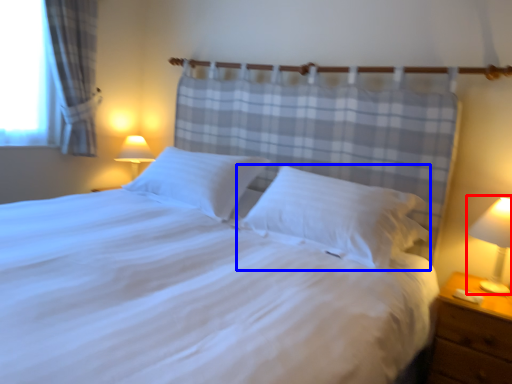
Question: Which of the following is the farthest to the observer, bedside lamp (highlighted by a red box) or pillow (highlighted by a blue box)?

Choices:
 (A) bedside lamp
 (B) pillow

Answer: (B)